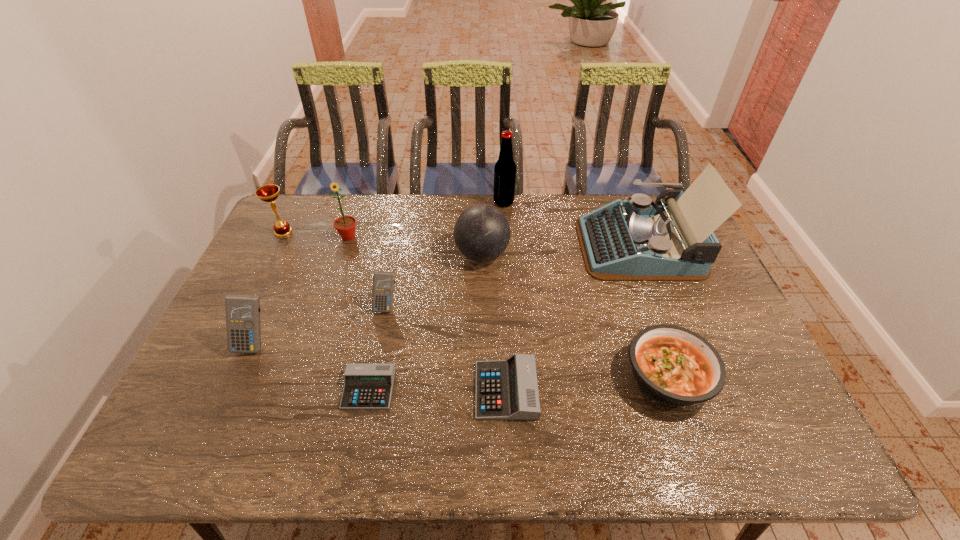
Identify the location of free space between the green sunflower and the bowling ball. The height and width of the screenshot is (540, 960). (416, 246).

Find the location of a particular element. The height and width of the screenshot is (540, 960). free point between the shortest calculator and the smaller blue calculator is located at coordinates (377, 347).

This screenshot has width=960, height=540. I want to click on object that is the third closest to the eighth tallest object, so click(482, 233).

Locate an element on the screen. This screenshot has width=960, height=540. object that ranks as the third closest to the second shortest calculator is located at coordinates click(383, 282).

Identify which calculator is the closest to the blue typewriter. Please provide its 2D coordinates. Your answer should be formatted as a tuple, i.e. [(x, y)], where the tuple contains the x and y coordinates of a point satisfying the conditions above.

[(507, 389)]

Identify the location of calculator that is the fourth closest one to the beer bottle. Image resolution: width=960 pixels, height=540 pixels. (242, 311).

Identify the location of free location that satisfies the following two spatial constraints: 1. on the front-facing side of the left blue calculator; 2. on the left side of the smaller gray calculator. (234, 389).

In order to click on free location that satisfies the following two spatial constraints: 1. on the typing side of the blue typewriter; 2. on the front-facing side of the farther blue calculator in this screenshot , I will do `click(662, 306)`.

You are a GUI agent. You are given a task and a screenshot of the screen. Output one action in this format:
    pyautogui.click(x=<x>, y=<y>)
    Task: Click on the vacant point that satisfies the following two spatial constraints: 1. on the back side of the farthest object; 2. on the right side of the right gray calculator
    
    Given the screenshot: What is the action you would take?
    pyautogui.click(x=497, y=202)